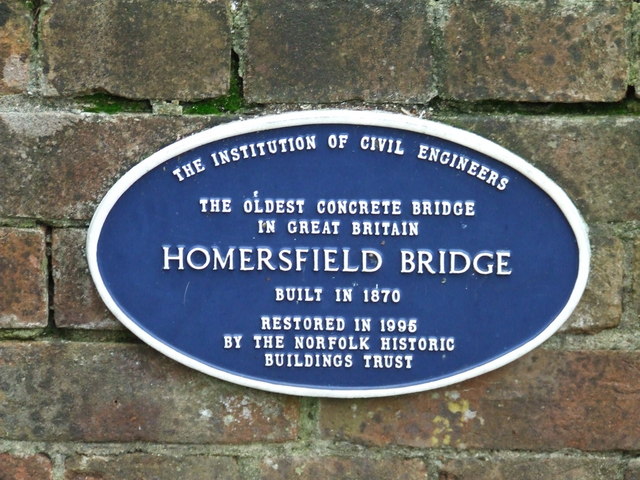
Locate an element on the screen. The height and width of the screenshot is (480, 640). oval plaque is located at coordinates (556, 264).